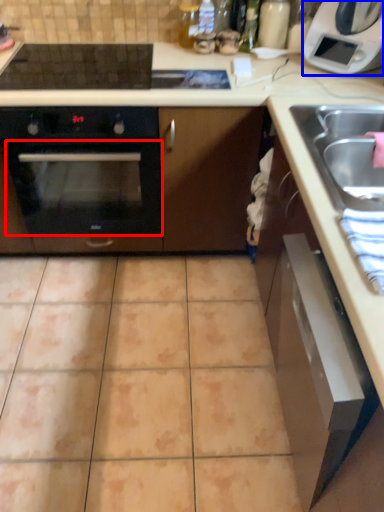
Question: Which point is further to the camera, oven (highlighted by a red box) or home appliance (highlighted by a blue box)?

Choices:
 (A) oven
 (B) home appliance

Answer: (A)